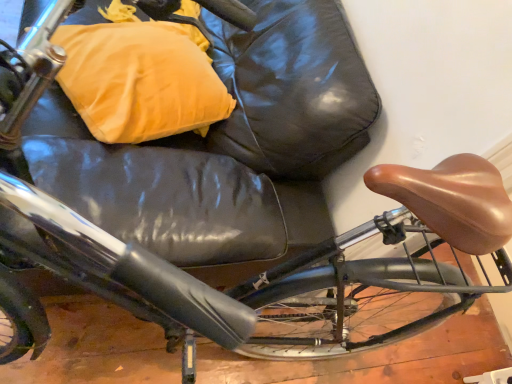
This screenshot has width=512, height=384. What do you see at coordinates (140, 80) in the screenshot? I see `matte yellow pillow at upper left` at bounding box center [140, 80].

At what (x,y) coordinates should I click in order to perform the action: click on matte yellow pillow at upper left. Please return your answer as a coordinate pair (x, y). This screenshot has width=512, height=384. Looking at the image, I should click on (140, 80).

This screenshot has height=384, width=512. In order to click on matte yellow pillow at upper left in this screenshot , I will do `click(140, 80)`.